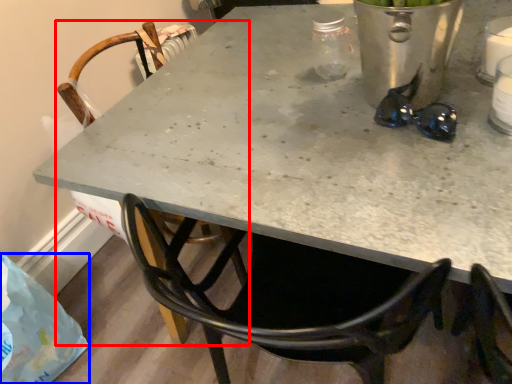
Question: Which point is further to the camera, chair (highlighted by a red box) or plastic bag (highlighted by a blue box)?

Choices:
 (A) chair
 (B) plastic bag

Answer: (B)